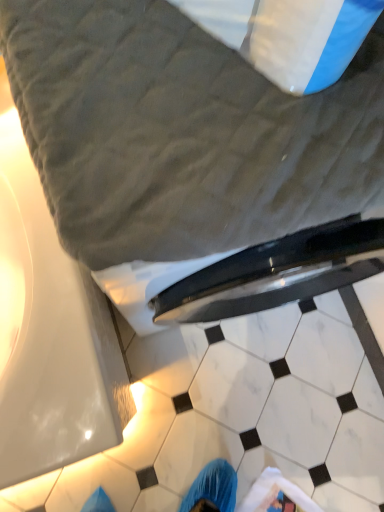
You are a GUI agent. You are given a task and a screenshot of the screen. Output one action in this format:
    pyautogui.click(x=<x>, y=<y>)
    Task: Click on the free space above white marble tile at center, acting as the first tile starting from the front (from a real-world perspective)
    
    Given the screenshot: What is the action you would take?
    pyautogui.click(x=232, y=405)